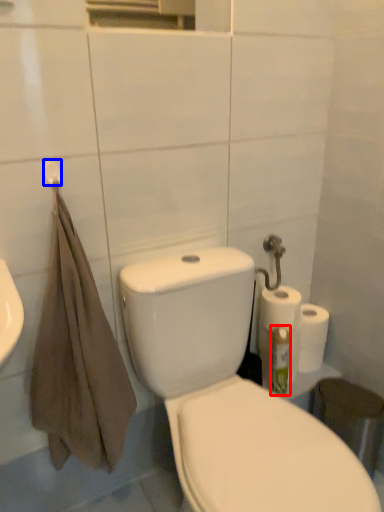
Question: Among these objects, which one is nearest to the camera, cleaning product (highlighted by a red box) or towel bar (highlighted by a blue box)?

Choices:
 (A) cleaning product
 (B) towel bar

Answer: (B)